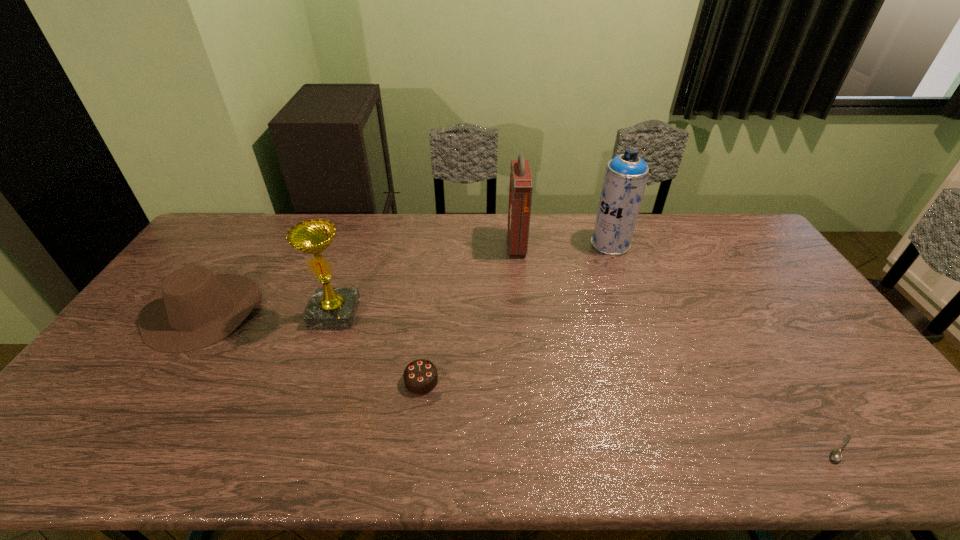
This screenshot has width=960, height=540. In order to click on free space located 0.380m on the front-facing side of the first-aid kit in this screenshot , I will do `click(403, 245)`.

Locate an element on the screen. This screenshot has height=540, width=960. free spot located on the front-facing side of the first-aid kit is located at coordinates (469, 245).

Locate an element on the screen. free space located 0.270m on the front-facing side of the first-aid kit is located at coordinates (433, 245).

You are a GUI agent. You are given a task and a screenshot of the screen. Output one action in this format:
    pyautogui.click(x=<x>, y=<y>)
    Task: Click on the free space located on the front-facing side of the fifth object from right to left
    This screenshot has height=540, width=960.
    Given the screenshot: What is the action you would take?
    pyautogui.click(x=310, y=383)

The width and height of the screenshot is (960, 540). I want to click on vacant space located on the back of the leftmost object, so click(249, 242).

Locate an element on the screen. The height and width of the screenshot is (540, 960). blank space located on the back of the chocolate cake is located at coordinates (x=432, y=289).

Find the location of a particular element. vacant space situated on the left of the soupspoon is located at coordinates pyautogui.click(x=752, y=449).

What are the coordinates of `aerosol can present at the far edge` in the screenshot? It's located at tap(626, 175).

You are a GUI agent. You are given a task and a screenshot of the screen. Output one action in this format:
    pyautogui.click(x=<x>, y=<y>)
    Task: Click on the first-aid kit that is at the far edge
    The height and width of the screenshot is (540, 960).
    Given the screenshot: What is the action you would take?
    pyautogui.click(x=521, y=183)

At what (x,y) coordinates should I click in order to perform the action: click on object that is positioned at the near edge. Please return your answer as a coordinate pair (x, y). This screenshot has width=960, height=540. Looking at the image, I should click on (835, 455).